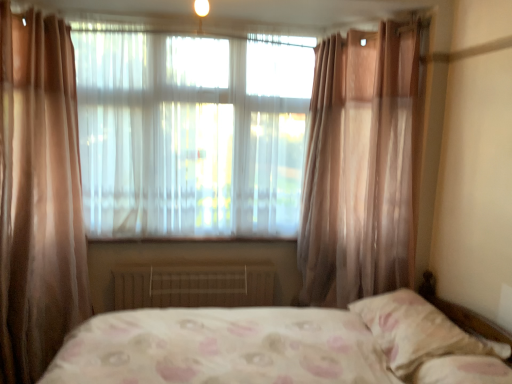
Locate an element on the screen. The width and height of the screenshot is (512, 384). free spot above translucent fabric window at center (from a real-world perspective) is located at coordinates (190, 30).